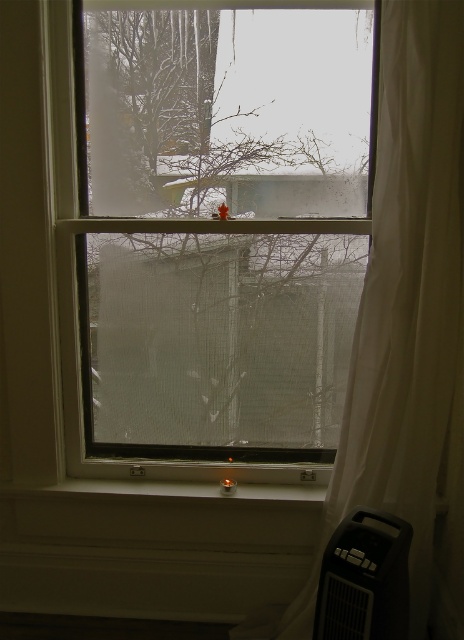
Can you confirm if clear glass window at center is smaller than black plastic air conditioner at lower right?

No, clear glass window at center is not smaller than black plastic air conditioner at lower right.

Which is more to the right, clear glass window at center or black plastic air conditioner at lower right?

black plastic air conditioner at lower right

At what (x,y) coordinates should I click in order to perform the action: click on clear glass window at center. Please return your answer as a coordinate pair (x, y). This screenshot has width=464, height=640. Looking at the image, I should click on (221, 224).

Can you confirm if white sheer curtain at right is positioned to the left of black plastic air conditioner at lower right?

Incorrect, white sheer curtain at right is not on the left side of black plastic air conditioner at lower right.

Which is more to the left, white sheer curtain at right or black plastic air conditioner at lower right?

Positioned to the left is black plastic air conditioner at lower right.

This screenshot has height=640, width=464. In order to click on white sheer curtain at right in this screenshot , I will do `click(406, 330)`.

Can you confirm if clear glass window at center is wider than white sheer curtain at right?

Yes, clear glass window at center is wider than white sheer curtain at right.

Locate an element on the screen. Image resolution: width=464 pixels, height=640 pixels. clear glass window at center is located at coordinates (221, 224).

This screenshot has height=640, width=464. I want to click on clear glass window at center, so click(221, 224).